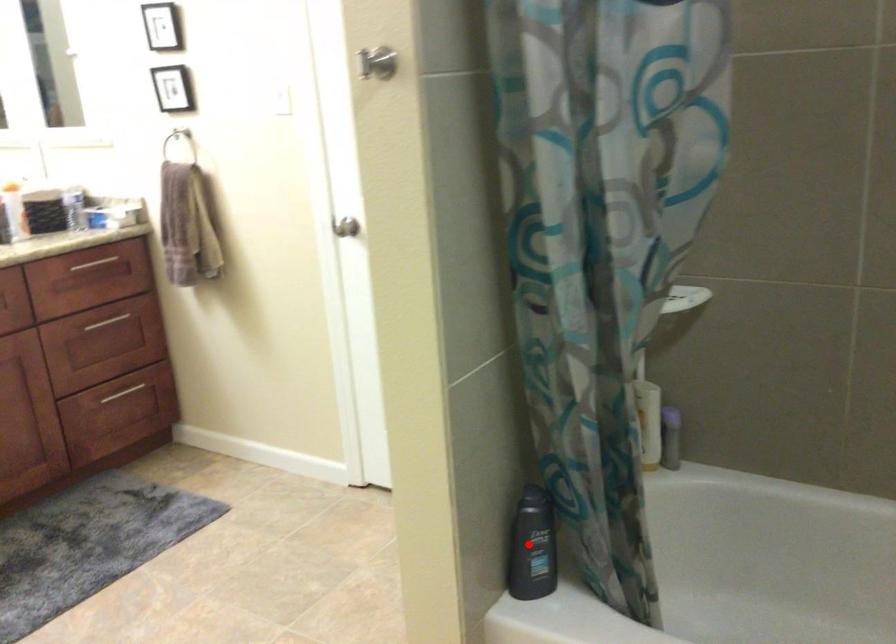
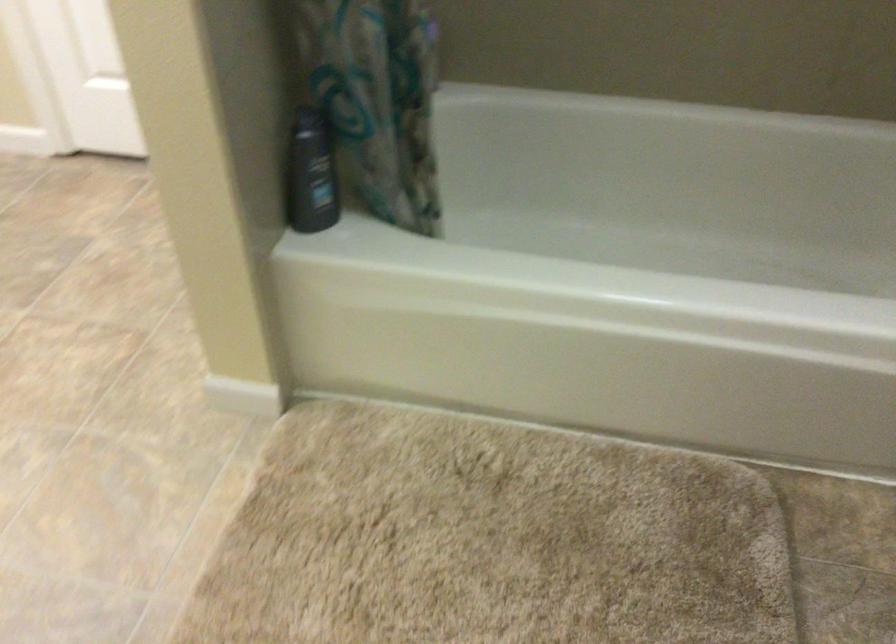
Question: A red point is marked in image1. In image2, is the corresponding 3D point closer to the camera or farther? Reply with the corresponding letter.

Choices:
 (A) The corresponding 3D point is closer.
 (B) The corresponding 3D point is farther.

Answer: (A)